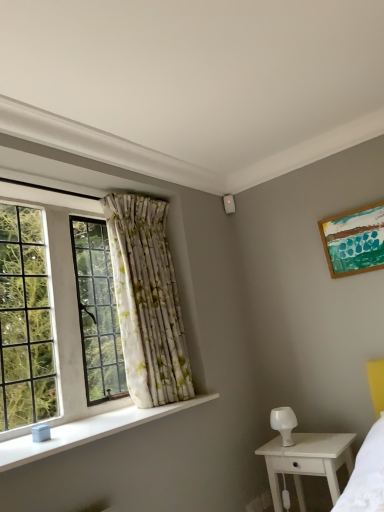
In order to click on spots to the right of white glossy lamp at lower right in this screenshot , I will do `click(328, 439)`.